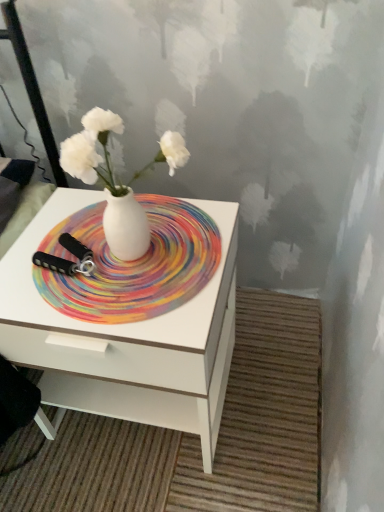
Locate an element on the screen. free space in front of white glossy vase at center is located at coordinates (140, 307).